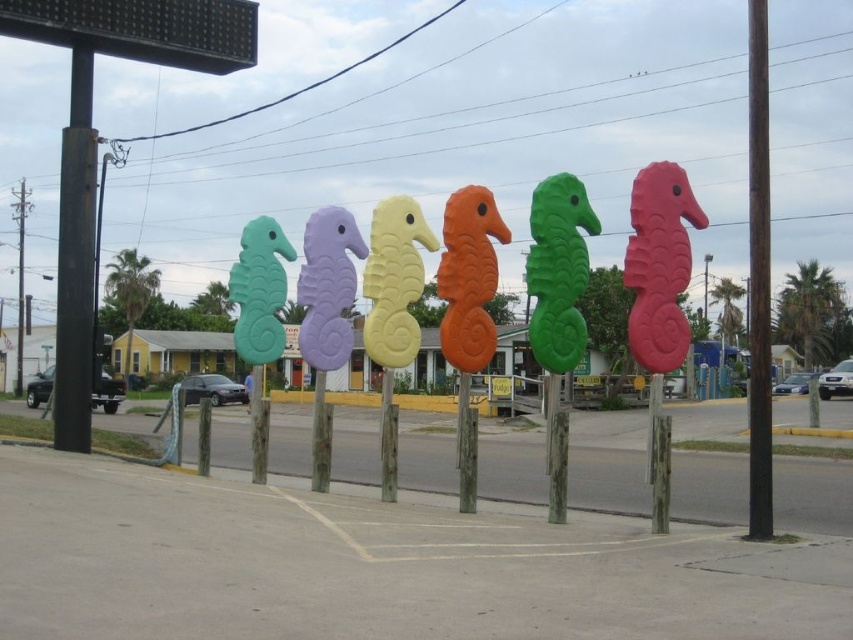
Question: Is black metal pole at left to the right of white plastic sign at center from the viewer's perspective?

Choices:
 (A) yes
 (B) no

Answer: (B)

Question: Which point is farther from the camera taking this photo?

Choices:
 (A) (83, 435)
 (B) (292, 355)

Answer: (B)

Question: Which is nearer to the white plastic sign at center?

Choices:
 (A) black metal pole at left
 (B) brown wooden pole at right

Answer: (A)

Question: Can you confirm if black metal pole at left is positioned above brown wooden pole at right?

Choices:
 (A) no
 (B) yes

Answer: (A)

Question: Does brown wooden pole at right have a lesser width compared to white plastic sign at center?

Choices:
 (A) yes
 (B) no

Answer: (B)

Question: Which point is closer to the camera taking this photo?

Choices:
 (A) (763, 365)
 (B) (286, 333)
 (C) (90, 188)

Answer: (A)